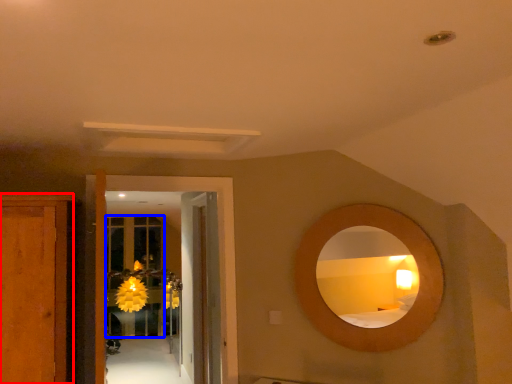
Question: Among these objects, which one is farthest to the camera, cabinetry (highlighted by a red box) or glass door (highlighted by a blue box)?

Choices:
 (A) cabinetry
 (B) glass door

Answer: (B)